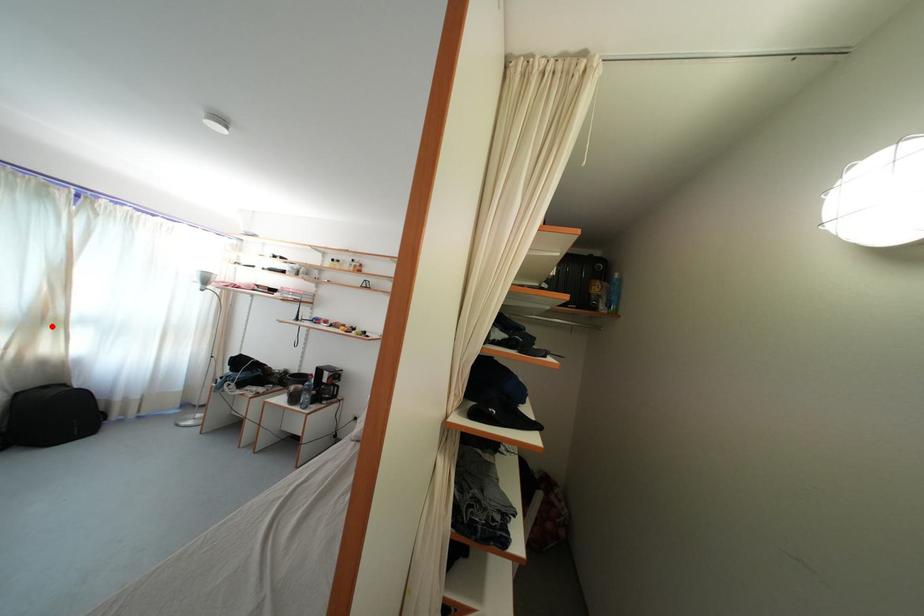
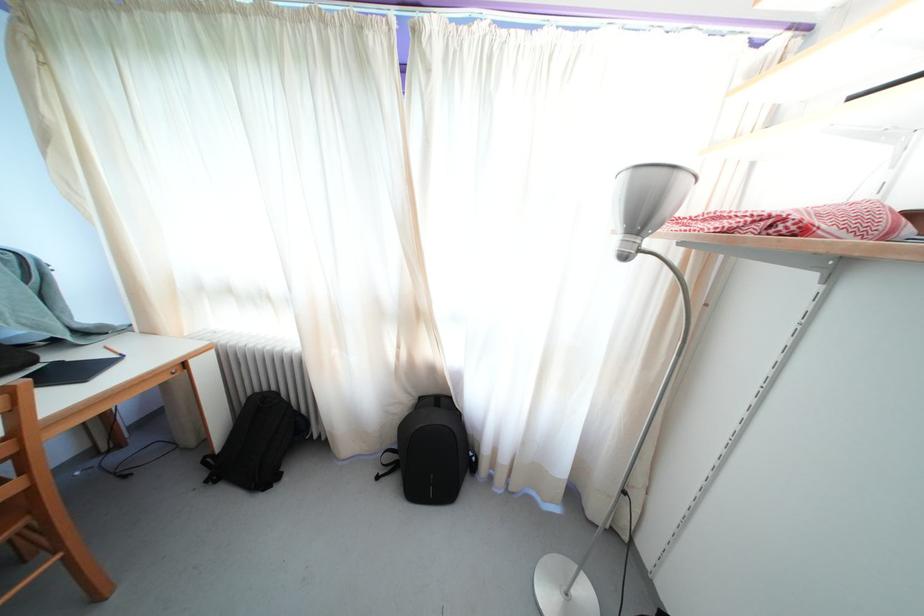
Question: I am providing you with two images of the same scene from different viewpoints. A red point is shown in image1. For the corresponding object point in image2, is it positioned nearer or farther from the camera?

Choices:
 (A) Nearer
 (B) Farther

Answer: (B)